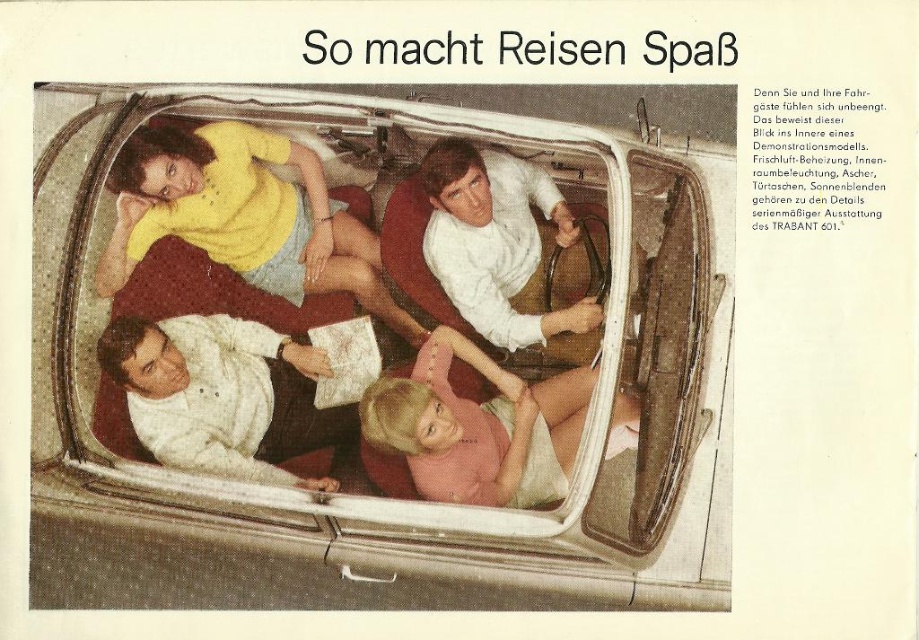
Is yellow fabric shirt at upper left wider than white smooth shirt at center?

Yes.

How much distance is there between yellow fabric shirt at upper left and white smooth shirt at center?

53.31 centimeters

Locate an element on the screen. This screenshot has width=919, height=640. yellow fabric shirt at upper left is located at coordinates (244, 216).

This screenshot has width=919, height=640. Find the location of `yellow fabric shirt at upper left`. yellow fabric shirt at upper left is located at coordinates (244, 216).

Consider the image. Between yellow fabric shirt at upper left and white textured shirt at lower left, which one has less height?

white textured shirt at lower left is shorter.

Who is higher up, yellow fabric shirt at upper left or white textured shirt at lower left?

yellow fabric shirt at upper left is above.

Identify the location of yellow fabric shirt at upper left. (244, 216).

Between pink fabric at center and white smooth shirt at center, which one appears on the right side from the viewer's perspective?

Positioned to the right is white smooth shirt at center.

From the picture: Can you confirm if pink fabric at center is bigger than white smooth shirt at center?

No, pink fabric at center is not bigger than white smooth shirt at center.

Is point (405, 408) behind point (471, 256)?

No.

Where is `pink fabric at center`? pink fabric at center is located at coordinates (478, 428).